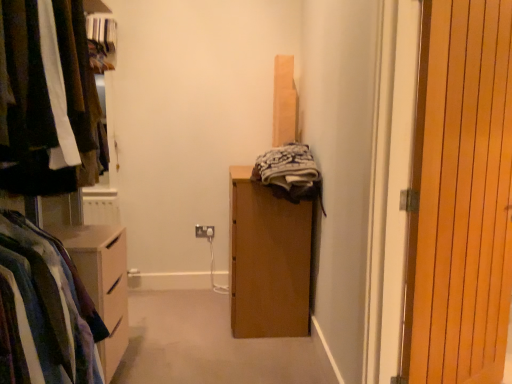
This screenshot has height=384, width=512. Find the location of `striped cotton shirt at left`. striped cotton shirt at left is located at coordinates (42, 310).

You are a GUI agent. You are given a task and a screenshot of the screen. Output one action in this format:
    pyautogui.click(x=<x>, y=<y>)
    Task: Click on the matte black clothes at left
    This screenshot has width=512, height=384.
    Given the screenshot: What is the action you would take?
    pyautogui.click(x=49, y=101)

Identify the location of white plastic electric outlet at center. (204, 231).

Is striped cotton shirt at left to the left of white plastic electric outlet at center from the viewer's perspective?

Yes.

Is white plastic electric outlet at center located within striped cotton shirt at left?

No, white plastic electric outlet at center is located outside of striped cotton shirt at left.

Is striped cotton shirt at left positioned with its back to white plastic electric outlet at center?

striped cotton shirt at left does not have its back to white plastic electric outlet at center.

Consider the image. From a real-world perspective, between white plastic electric outlet at center and wooden at right, who is vertically lower?

In real-world perspective, white plastic electric outlet at center is lower.

Is white plastic electric outlet at center turned away from wooden at right?

No, white plastic electric outlet at center's orientation is not away from wooden at right.

How different are the orientations of white plastic electric outlet at center and wooden at right in degrees?

34.1 degrees.

Is white plastic electric outlet at center outside of wooden at right?

white plastic electric outlet at center lies outside wooden at right's area.

From a real-world perspective, which object stands above the other?

striped cotton shirt at left.

Does white plastic electric outlet at center come in front of striped cotton shirt at left?

No, the depth of white plastic electric outlet at center is greater than that of striped cotton shirt at left.

From the picture: Can you tell me how much white plastic electric outlet at center and striped cotton shirt at left differ in facing direction?

The facing directions of white plastic electric outlet at center and striped cotton shirt at left are 90.2 degrees apart.

In terms of height, does white plastic electric outlet at center look taller or shorter compared to matte black clothes at left?

Considering their sizes, white plastic electric outlet at center has less height than matte black clothes at left.

Would you say white plastic electric outlet at center is inside or outside matte black clothes at left?

white plastic electric outlet at center is not enclosed by matte black clothes at left.

Is white plastic electric outlet at center positioned far away from matte black clothes at left?

Yes, white plastic electric outlet at center is far from matte black clothes at left.

Between white plastic electric outlet at center and matte black clothes at left, which one is positioned behind?

white plastic electric outlet at center is behind.

Between striped cotton shirt at left and wooden at right, which one has more height?

wooden at right is taller.

Looking at this image, is striped cotton shirt at left facing away from wooden at right?

No, striped cotton shirt at left is not facing away from wooden at right.

Considering the sizes of objects striped cotton shirt at left and wooden at right in the image provided, who is wider, striped cotton shirt at left or wooden at right?

With larger width is striped cotton shirt at left.

Considering the relative sizes of striped cotton shirt at left and wooden at right in the image provided, is striped cotton shirt at left smaller than wooden at right?

No.

Is wooden at right looking in the opposite direction of matte black clothes at left?

No, wooden at right is not facing away from matte black clothes at left.

How different are the orientations of wooden at right and matte black clothes at left in degrees?

They differ by 56 degrees in their facing directions.

The width and height of the screenshot is (512, 384). Find the location of `door below the matte black clothes at left (from a real-world perspective)`. door below the matte black clothes at left (from a real-world perspective) is located at coordinates (461, 196).

From a real-world perspective, which object rests below the other?

In real-world perspective, wooden at right is lower.

From the picture: Would you say wooden at right is inside or outside striped cotton shirt at left?

wooden at right exists outside the volume of striped cotton shirt at left.

What are the coordinates of `clothing below the wooden at right (from a real-world perspective)` in the screenshot? It's located at (42, 310).

Is wooden at right not close to striped cotton shirt at left?

Indeed, wooden at right is not near striped cotton shirt at left.

Measure the distance between wooden at right and striped cotton shirt at left.

4.48 feet.

The height and width of the screenshot is (384, 512). In order to click on electric outlet above the striped cotton shirt at left (from the image's perspective) in this screenshot , I will do `click(204, 231)`.

This screenshot has width=512, height=384. Identify the location of door above the white plastic electric outlet at center (from a real-world perspective). (461, 196).

Considering their positions, is wooden at right positioned closer to striped cotton shirt at left than white plastic electric outlet at center?

wooden at right.

When comparing their distances from matte black clothes at left, does white plastic electric outlet at center or striped cotton shirt at left seem further?

white plastic electric outlet at center.

From the image, which object appears to be nearer to matte black clothes at left, striped cotton shirt at left or white plastic electric outlet at center?

striped cotton shirt at left is closer to matte black clothes at left.

Estimate the real-world distances between objects in this image. Which object is further from matte black clothes at left, striped cotton shirt at left or wooden at right?

The object further to matte black clothes at left is wooden at right.

When comparing their distances from striped cotton shirt at left, does matte black clothes at left or white plastic electric outlet at center seem further?

The object further to striped cotton shirt at left is white plastic electric outlet at center.

Looking at the image, which one is located further to white plastic electric outlet at center, wooden at right or striped cotton shirt at left?

wooden at right.

From the image, which object appears to be nearer to striped cotton shirt at left, wooden at right or matte black clothes at left?

matte black clothes at left lies closer to striped cotton shirt at left than the other object.

Looking at this image, based on their spatial positions, is white plastic electric outlet at center or wooden at right further from striped cotton shirt at left?

white plastic electric outlet at center lies further to striped cotton shirt at left than the other object.

The height and width of the screenshot is (384, 512). Find the location of `clothing between matte black clothes at left and white plastic electric outlet at center in the front-back direction`. clothing between matte black clothes at left and white plastic electric outlet at center in the front-back direction is located at coordinates (42, 310).

The height and width of the screenshot is (384, 512). I want to click on clothing between matte black clothes at left and wooden at right in the horizontal direction, so click(42, 310).

Image resolution: width=512 pixels, height=384 pixels. Identify the location of door located between matte black clothes at left and white plastic electric outlet at center in the depth direction. (461, 196).

Locate an element on the screen. door between striped cotton shirt at left and white plastic electric outlet at center in the front-back direction is located at coordinates click(461, 196).